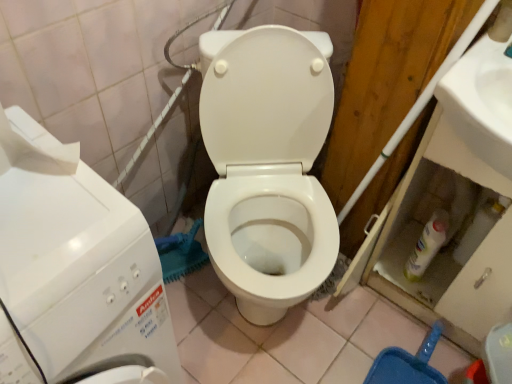
Image resolution: width=512 pixels, height=384 pixels. Describe the element at coordinates (481, 103) in the screenshot. I see `white glossy sink at upper right` at that location.

What are the coordinates of `white glossy washing machine at left` in the screenshot? It's located at (78, 265).

Identify the location of white glossy sink at upper right. (481, 103).

Between white glossy washing machine at left and white glossy sink at upper right, which one has more height?

Standing taller between the two is white glossy washing machine at left.

Is white glossy washing machine at left oriented towards white glossy sink at upper right?

A: No, white glossy washing machine at left is not turned towards white glossy sink at upper right.

From a real-world perspective, is white glossy washing machine at left positioned over white glossy sink at upper right based on gravity?

Incorrect, from a real-world perspective, white glossy washing machine at left is lower than white glossy sink at upper right.

In the scene shown: Is white glossy sink at upper right facing away from white glossy toilet at center?

No, white glossy sink at upper right is not facing the opposite direction of white glossy toilet at center.

Which of these two, white glossy sink at upper right or white glossy toilet at center, is smaller?

Smaller between the two is white glossy sink at upper right.

From the picture: Is white glossy sink at upper right taller or shorter than white glossy toilet at center?

Clearly, white glossy sink at upper right is shorter compared to white glossy toilet at center.

Is white glossy sink at upper right to the right of white glossy toilet at center from the viewer's perspective?

Yes, white glossy sink at upper right is to the right of white glossy toilet at center.

In the scene shown: Are white glossy sink at upper right and white glossy washing machine at left located far from each other?

That's not correct — white glossy sink at upper right is a little close to white glossy washing machine at left.

Is white glossy sink at upper right turned away from white glossy washing machine at left?

white glossy sink at upper right is not turned away from white glossy washing machine at left.

Consider the image. From a real-world perspective, is white glossy sink at upper right positioned under white glossy washing machine at left based on gravity?

No.

Is white glossy sink at upper right taller than white glossy washing machine at left?

Incorrect, the height of white glossy sink at upper right is not larger of that of white glossy washing machine at left.

From a real-world perspective, which is physically below, white glossy washing machine at left or white glossy toilet at center?

white glossy toilet at center is physically lower.

Image resolution: width=512 pixels, height=384 pixels. Find the location of `toilet to the right of white glossy washing machine at left`. toilet to the right of white glossy washing machine at left is located at coordinates (267, 166).

Which object is positioned more to the right, white glossy washing machine at left or white glossy toilet at center?

Positioned to the right is white glossy toilet at center.

Who is more distant, white glossy toilet at center or white glossy washing machine at left?

Positioned behind is white glossy toilet at center.

Does point (237, 96) lie in front of point (50, 200)?

No, (237, 96) is further to viewer.

Can you see white glossy toilet at center touching white glossy washing machine at left?

No, white glossy toilet at center is not making contact with white glossy washing machine at left.

Which is correct: white glossy toilet at center is inside white glossy washing machine at left, or outside of it?

white glossy toilet at center is not enclosed by white glossy washing machine at left.

In the image, is white glossy toilet at center positioned in front of or behind white glossy sink at upper right?

Clearly, white glossy toilet at center is in front of white glossy sink at upper right.

Between white glossy toilet at center and white glossy sink at upper right, which one has more height?

With more height is white glossy toilet at center.

Based on the photo, are white glossy toilet at center and white glossy sink at upper right making contact?

No, white glossy toilet at center is not making contact with white glossy sink at upper right.

Image resolution: width=512 pixels, height=384 pixels. Find the location of `sink lying on the right of white glossy washing machine at left`. sink lying on the right of white glossy washing machine at left is located at coordinates (481, 103).

Identify the location of toilet on the left of white glossy sink at upper right. (267, 166).

From the image, which object appears to be nearer to white glossy toilet at center, white glossy sink at upper right or white glossy washing machine at left?

white glossy sink at upper right.

Based on their spatial positions, is white glossy washing machine at left or white glossy toilet at center closer to white glossy sink at upper right?

white glossy toilet at center is closer to white glossy sink at upper right.

Estimate the real-world distances between objects in this image. Which object is closer to white glossy toilet at center, white glossy washing machine at left or white glossy sink at upper right?

Based on the image, white glossy sink at upper right appears to be nearer to white glossy toilet at center.

Looking at the image, which one is located further to white glossy washing machine at left, white glossy toilet at center or white glossy sink at upper right?

white glossy sink at upper right.

Estimate the real-world distances between objects in this image. Which object is closer to white glossy washing machine at left, white glossy sink at upper right or white glossy toilet at center?

white glossy toilet at center is positioned closer to the anchor white glossy washing machine at left.

Estimate the real-world distances between objects in this image. Which object is further from white glossy sink at upper right, white glossy toilet at center or white glossy washing machine at left?

Among the two, white glossy washing machine at left is located further to white glossy sink at upper right.

Find the location of a particular element. toilet between white glossy washing machine at left and white glossy sink at upper right in the horizontal direction is located at coordinates (267, 166).